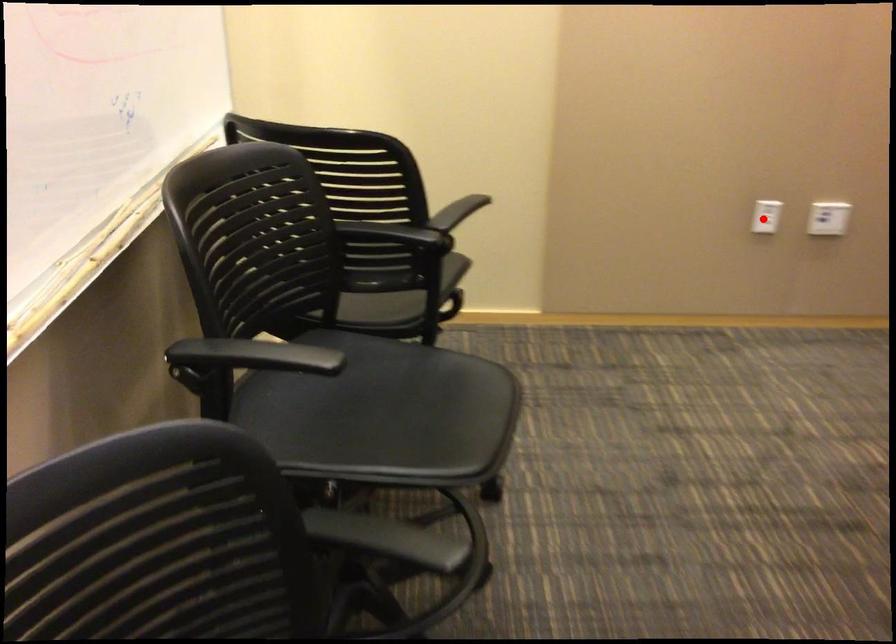
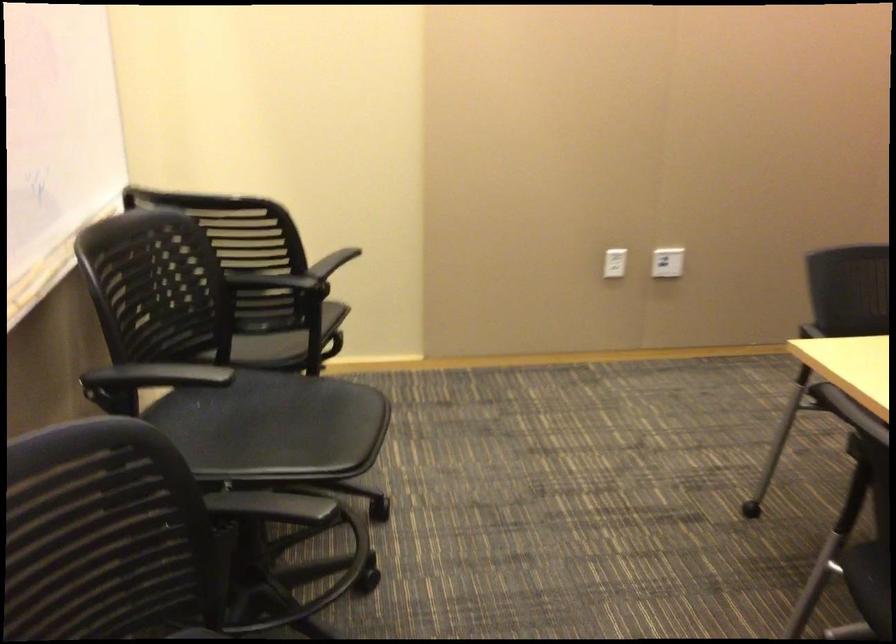
Where in the second image is the point corresponding to the highlighted location from the first image?

(615, 263)